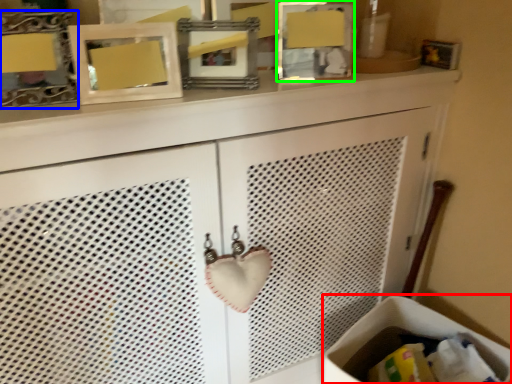
Question: Which object is the farthest from laundry basket (highlighted by a red box)? Choose among these: picture frame (highlighted by a blue box) or picture frame (highlighted by a green box).

Choices:
 (A) picture frame
 (B) picture frame

Answer: (A)